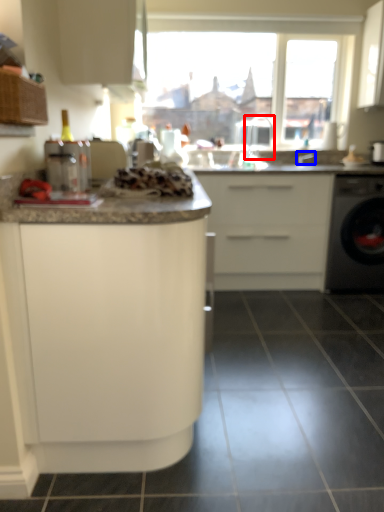
Question: Which of the following is the closest to the observer, faucet (highlighted by a red box) or faucet (highlighted by a blue box)?

Choices:
 (A) faucet
 (B) faucet

Answer: (A)